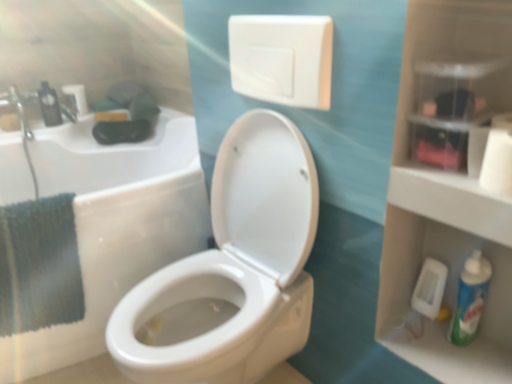
Where is `white glossy toilet at center`? This screenshot has height=384, width=512. white glossy toilet at center is located at coordinates (89, 233).

Describe the element at coordinates (497, 162) in the screenshot. The width and height of the screenshot is (512, 384). I see `white matte toilet paper at upper right, acting as the first toilet paper starting from the right` at that location.

What do you see at coordinates (10, 122) in the screenshot?
I see `white matte toilet paper at left, the second toilet paper in the front-to-back sequence` at bounding box center [10, 122].

This screenshot has height=384, width=512. What are the coordinates of `black plastic mouthwash at left, the 2th mouthwash positioned from the right` in the screenshot? It's located at (49, 105).

This screenshot has height=384, width=512. Describe the element at coordinates (430, 288) in the screenshot. I see `white plastic toilet bowl cleaner at lower right` at that location.

Image resolution: width=512 pixels, height=384 pixels. What are the coordinates of `teal fabric towel at left` in the screenshot? It's located at coord(39,265).

Is white matte toilet paper at upper right, which appears as the third toilet paper when viewed from the top, to the left of white plastic toilet bowl cleaner at lower right from the viewer's perspective?

Indeed, white matte toilet paper at upper right, which appears as the third toilet paper when viewed from the top, is positioned on the left side of white plastic toilet bowl cleaner at lower right.

Which is in front, point (484, 179) or point (413, 301)?

Point (484, 179)

Could you tell me if white matte toilet paper at upper right, arranged as the 1th toilet paper when viewed from the front, is turned towards white plastic toilet bowl cleaner at lower right?

No, white matte toilet paper at upper right, arranged as the 1th toilet paper when viewed from the front, is not oriented towards white plastic toilet bowl cleaner at lower right.

In the scene shown: Which point is more distant from viewer, (79,111) or (242,118)?

The point (79,111) is more distant.

You are a GUI agent. You are given a task and a screenshot of the screen. Output one action in this format:
    pyautogui.click(x=<x>, y=<y>)
    Task: Click on the toilet below the white matte toilet paper at upper left, the first toilet paper from the top (from the image's perspective)
    
    Given the screenshot: What is the action you would take?
    pyautogui.click(x=234, y=267)

From a real-world perspective, is white matte toilet paper at upper left, placed as the 2th toilet paper when sorted from left to right, over white glossy toilet at center?

Yes, from a real-world perspective, white matte toilet paper at upper left, placed as the 2th toilet paper when sorted from left to right, is on top of white glossy toilet at center.

Considering the sizes of white matte toilet paper at upper left, arranged as the third toilet paper when ordered from the bottom, and white glossy toilet at center in the image, is white matte toilet paper at upper left, arranged as the third toilet paper when ordered from the bottom, wider or thinner than white glossy toilet at center?

In the image, white matte toilet paper at upper left, arranged as the third toilet paper when ordered from the bottom, appears to be more narrow than white glossy toilet at center.

Based on their sizes in the image, would you say white matte toilet paper at upper right, which is the 3th toilet paper in left-to-right order, is bigger or smaller than white matte toilet paper at left, acting as the first toilet paper starting from the left?

In the image, white matte toilet paper at upper right, which is the 3th toilet paper in left-to-right order, appears to be larger than white matte toilet paper at left, acting as the first toilet paper starting from the left.

Between white matte toilet paper at upper right, which is the 3th toilet paper in left-to-right order, and white matte toilet paper at left, the 2th toilet paper positioned from the top, which one appears on the right side from the viewer's perspective?

Positioned to the right is white matte toilet paper at upper right, which is the 3th toilet paper in left-to-right order.

What's the angular difference between white matte toilet paper at upper right, the 3th toilet paper when ordered from back to front, and white matte toilet paper at left, acting as the first toilet paper starting from the left,'s facing directions?

90.6 degrees separate the facing orientations of white matte toilet paper at upper right, the 3th toilet paper when ordered from back to front, and white matte toilet paper at left, acting as the first toilet paper starting from the left.

Is white matte toilet paper at left, the second toilet paper in the front-to-back sequence, at the back of white matte toilet paper at upper right, acting as the first toilet paper starting from the right?

white matte toilet paper at upper right, acting as the first toilet paper starting from the right, is not turned away from white matte toilet paper at left, the second toilet paper in the front-to-back sequence.

Where is `mouthwash above the white matte toilet paper at upper right, which is the 3th toilet paper in left-to-right order (from the image's perspective)`? This screenshot has width=512, height=384. mouthwash above the white matte toilet paper at upper right, which is the 3th toilet paper in left-to-right order (from the image's perspective) is located at coordinates (49, 105).

Which object is positioned more to the left, white matte toilet paper at upper right, which is counted as the 1th toilet paper, starting from the bottom, or black plastic mouthwash at left, arranged as the first mouthwash when viewed from the left?

Positioned to the left is black plastic mouthwash at left, arranged as the first mouthwash when viewed from the left.

Which of these two, white matte toilet paper at upper right, which is counted as the 1th toilet paper, starting from the bottom, or black plastic mouthwash at left, acting as the 1th mouthwash starting from the back, is wider?

Wider between the two is white matte toilet paper at upper right, which is counted as the 1th toilet paper, starting from the bottom.

Is teal fabric towel at left taller than black plastic mouthwash at left, acting as the first mouthwash starting from the top?

Indeed, teal fabric towel at left has a greater height compared to black plastic mouthwash at left, acting as the first mouthwash starting from the top.

From the picture: From the image's perspective, is teal fabric towel at left above or below black plastic mouthwash at left, the second mouthwash when ordered from front to back?

teal fabric towel at left is below black plastic mouthwash at left, the second mouthwash when ordered from front to back.

Can you confirm if teal fabric towel at left is bigger than black plastic mouthwash at left, acting as the 1th mouthwash starting from the back?

Indeed, teal fabric towel at left has a larger size compared to black plastic mouthwash at left, acting as the 1th mouthwash starting from the back.

Is teal fabric towel at left oriented away from black plastic mouthwash at left, the 2th mouthwash positioned from the right?

Absolutely, teal fabric towel at left is directed away from black plastic mouthwash at left, the 2th mouthwash positioned from the right.

Which of these two, white matte toilet paper at upper right, which is counted as the 1th toilet paper, starting from the bottom, or white glossy toilet at center, stands shorter?

white matte toilet paper at upper right, which is counted as the 1th toilet paper, starting from the bottom, is shorter.

Which object is positioned more to the right, white matte toilet paper at upper right, which is the 3th toilet paper in left-to-right order, or white glossy toilet at center?

Positioned to the right is white matte toilet paper at upper right, which is the 3th toilet paper in left-to-right order.

Is white matte toilet paper at upper right, which appears as the third toilet paper when viewed from the top, closer to camera compared to white glossy toilet at center?

No, the depth of white matte toilet paper at upper right, which appears as the third toilet paper when viewed from the top, is greater than that of white glossy toilet at center.

Is white matte toilet paper at upper right, which is counted as the 1th toilet paper, starting from the bottom, not inside white glossy toilet at center?

white matte toilet paper at upper right, which is counted as the 1th toilet paper, starting from the bottom, lies outside white glossy toilet at center's area.

Considering the relative sizes of white glossy toilet at center and green plastic mouthwash at lower right, which is the 1th mouthwash from front to back, in the image provided, is white glossy toilet at center shorter than green plastic mouthwash at lower right, which is the 1th mouthwash from front to back,?

Incorrect, the height of white glossy toilet at center does not fall short of that of green plastic mouthwash at lower right, which is the 1th mouthwash from front to back.

Consider the image. Is white glossy toilet at center to the left of green plastic mouthwash at lower right, which is the 1th mouthwash from front to back, from the viewer's perspective?

Yes.

This screenshot has height=384, width=512. What are the coordinates of `toilet located above the green plastic mouthwash at lower right, marked as the first mouthwash in a bottom-to-top arrangement (from the image's perspective)` in the screenshot? It's located at (234, 267).

What's the angular difference between white glossy toilet at center and green plastic mouthwash at lower right, marked as the first mouthwash in a bottom-to-top arrangement,'s facing directions?

1.42 degrees separate the facing orientations of white glossy toilet at center and green plastic mouthwash at lower right, marked as the first mouthwash in a bottom-to-top arrangement.

The width and height of the screenshot is (512, 384). In order to click on the 1st toilet paper above when counting from the white plastic toilet bowl cleaner at lower right (from the image's perspective) in this screenshot , I will do `click(497, 162)`.

Locate an element on the screen. The width and height of the screenshot is (512, 384). toilet that appears in front of the white matte toilet paper at upper left, the 3th toilet paper when ordered from front to back is located at coordinates coord(234,267).

Based on their spatial positions, is white plastic toilet bowl cleaner at lower right or white glossy toilet at center closer to green plastic mouthwash at lower right, positioned as the second mouthwash in left-to-right order?

white plastic toilet bowl cleaner at lower right is positioned closer to the anchor green plastic mouthwash at lower right, positioned as the second mouthwash in left-to-right order.

Which object lies nearer to the anchor point white matte toilet paper at left, positioned as the 2th toilet paper in bottom-to-top order, black plastic mouthwash at left, arranged as the first mouthwash when viewed from the left, or white plastic toilet bowl cleaner at lower right?

The object closer to white matte toilet paper at left, positioned as the 2th toilet paper in bottom-to-top order, is black plastic mouthwash at left, arranged as the first mouthwash when viewed from the left.

Looking at the image, which one is located further to white glossy toilet at center, white matte toilet paper at upper left, the first toilet paper from the top, or white glossy toilet at center?

white matte toilet paper at upper left, the first toilet paper from the top, is further to white glossy toilet at center.

Estimate the real-world distances between objects in this image. Which object is closer to teal fabric towel at left, white glossy toilet at center or white glossy toilet at center?

white glossy toilet at center.

Which object lies nearer to the anchor point white glossy toilet at center, white matte toilet paper at left, the second toilet paper in the front-to-back sequence, or teal fabric towel at left?

Among the two, teal fabric towel at left is located nearer to white glossy toilet at center.

When comparing their distances from white matte toilet paper at upper left, arranged as the third toilet paper when ordered from the bottom, does white matte toilet paper at upper right, which is the 3th toilet paper in left-to-right order, or white glossy toilet at center seem further?

white matte toilet paper at upper right, which is the 3th toilet paper in left-to-right order, lies further to white matte toilet paper at upper left, arranged as the third toilet paper when ordered from the bottom, than the other object.

Considering their positions, is white plastic toilet bowl cleaner at lower right positioned further to white matte toilet paper at upper left, arranged as the third toilet paper when ordered from the bottom, than white matte toilet paper at left, positioned as the 2th toilet paper in bottom-to-top order?

white plastic toilet bowl cleaner at lower right.

Based on their spatial positions, is green plastic mouthwash at lower right, positioned as the first mouthwash in right-to-left order, or white glossy toilet at center closer to black plastic mouthwash at left, acting as the 1th mouthwash starting from the back?

The object closer to black plastic mouthwash at left, acting as the 1th mouthwash starting from the back, is white glossy toilet at center.

Where is `bath situated between teal fabric towel at left and white glossy toilet at center from left to right`? The image size is (512, 384). bath situated between teal fabric towel at left and white glossy toilet at center from left to right is located at coordinates (89, 233).

The width and height of the screenshot is (512, 384). I want to click on toilet between black plastic mouthwash at left, arranged as the first mouthwash when viewed from the left, and green plastic mouthwash at lower right, positioned as the first mouthwash in right-to-left order, so click(234, 267).

Identify the location of bath towel between white matte toilet paper at upper left, the 3th toilet paper when ordered from front to back, and white matte toilet paper at upper right, which is counted as the 1th toilet paper, starting from the bottom, in the horizontal direction. coord(39,265).

Find the location of a particular element. bath towel between white glossy toilet at center and white matte toilet paper at upper left, the first toilet paper from the top, along the z-axis is located at coordinates (39, 265).